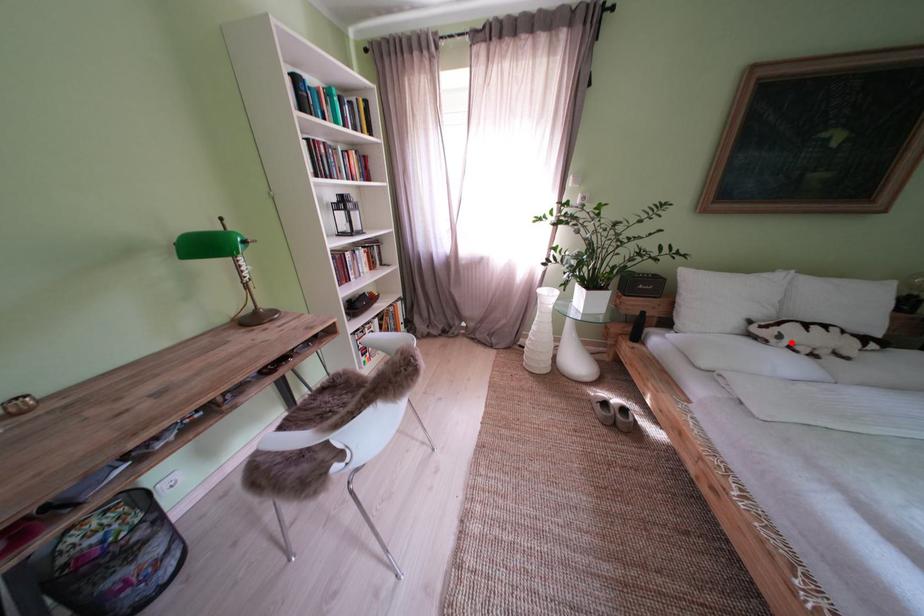
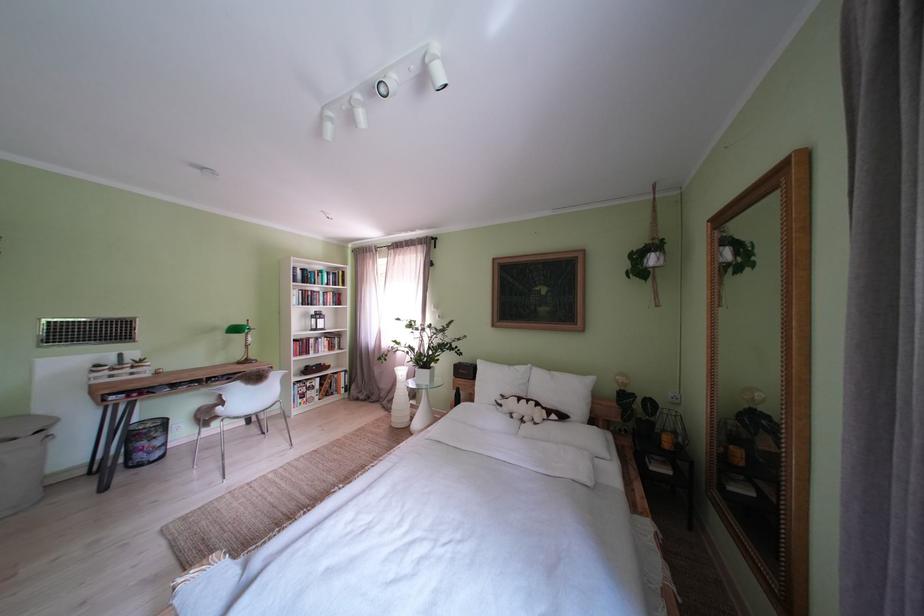
Question: A red point is marked in image1. In image2, is the corresponding 3D point closer to the camera or farther? Reply with the corresponding letter.

Choices:
 (A) The corresponding 3D point is closer.
 (B) The corresponding 3D point is farther.

Answer: (B)